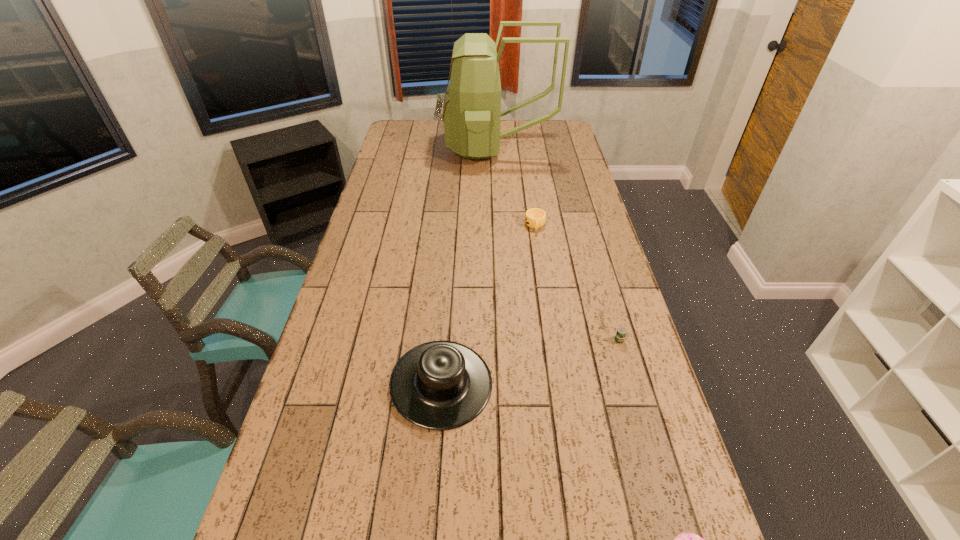
Find the location of `free point that satisfies the following two spatial constraints: 1. on the front pocket of the farthest object; 2. on the back side of the beer can`. free point that satisfies the following two spatial constraints: 1. on the front pocket of the farthest object; 2. on the back side of the beer can is located at coordinates (511, 340).